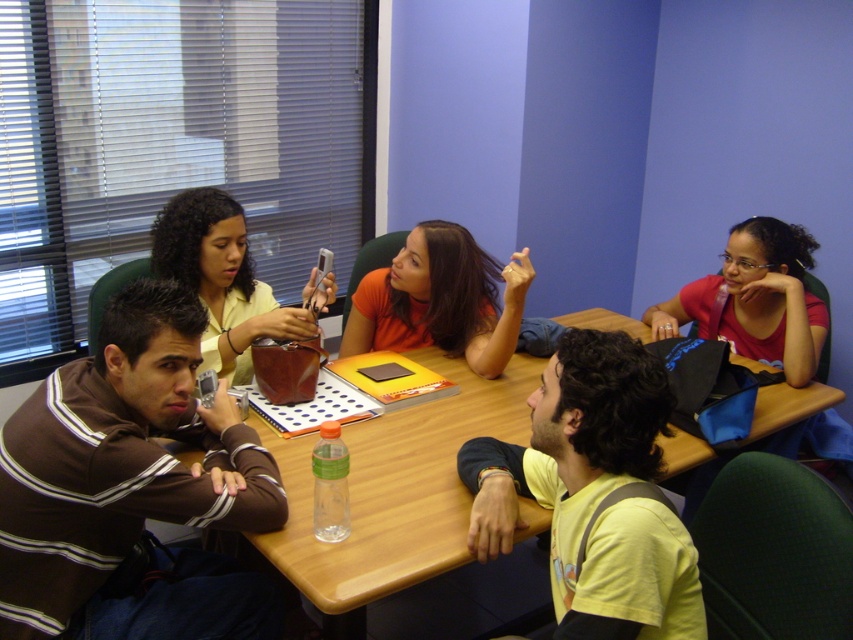
You are standing in front of the rectangular wooden table where the group is seated. You notice two points marked on the table surface at coordinates point (508,346) and point (733,252). If you want to place a small object closer to you, which point should you choose?

You should choose point (508,346) because it is closer to the viewer than point (733,252).

You are a photographer trying to capture a group photo of the people around the table. You want to ensure both the brown striped sweater at center and the yellow matte shirt at center are visible in the frame. Based on their positions, which one should you focus on first to include both in the shot?

The brown striped sweater at center is positioned on the left side of yellow matte shirt at center, so focusing on the brown striped sweater at center first would help ensure both are included in the frame since it is closer to the left edge.